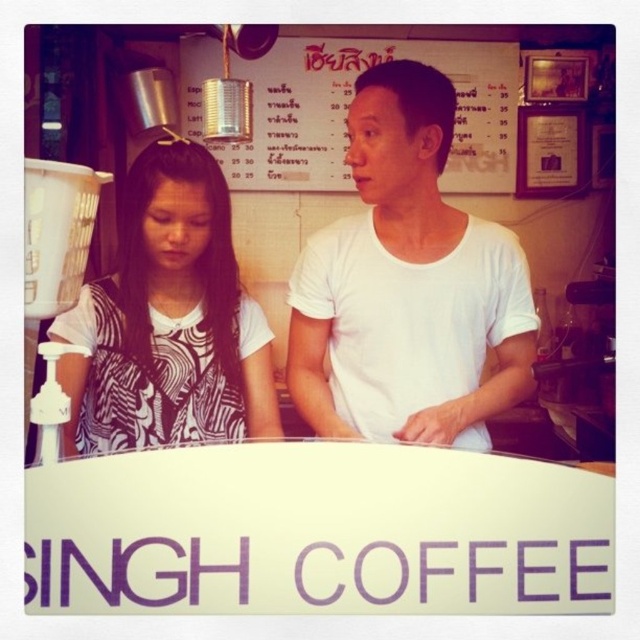
Question: Among these points, which one is farthest from the camera?

Choices:
 (A) pos(436,419)
 (B) pos(184,186)
 (C) pos(272,116)

Answer: (C)

Question: Is the position of white printed shirt at left more distant than that of metallic tin can at upper center?

Choices:
 (A) no
 (B) yes

Answer: (A)

Question: Which of the following is the closest to the observer?

Choices:
 (A) white matte shirt at center
 (B) white printed shirt at left
 (C) metallic tin can at upper center

Answer: (B)

Question: Which point is closer to the camera?

Choices:
 (A) (285, 70)
 (B) (97, 314)
 (C) (444, 352)

Answer: (B)

Question: Does white printed shirt at left have a lesser width compared to metallic tin can at upper center?

Choices:
 (A) yes
 (B) no

Answer: (A)

Question: Is white printed shirt at left to the right of metallic tin can at upper center from the viewer's perspective?

Choices:
 (A) no
 (B) yes

Answer: (A)